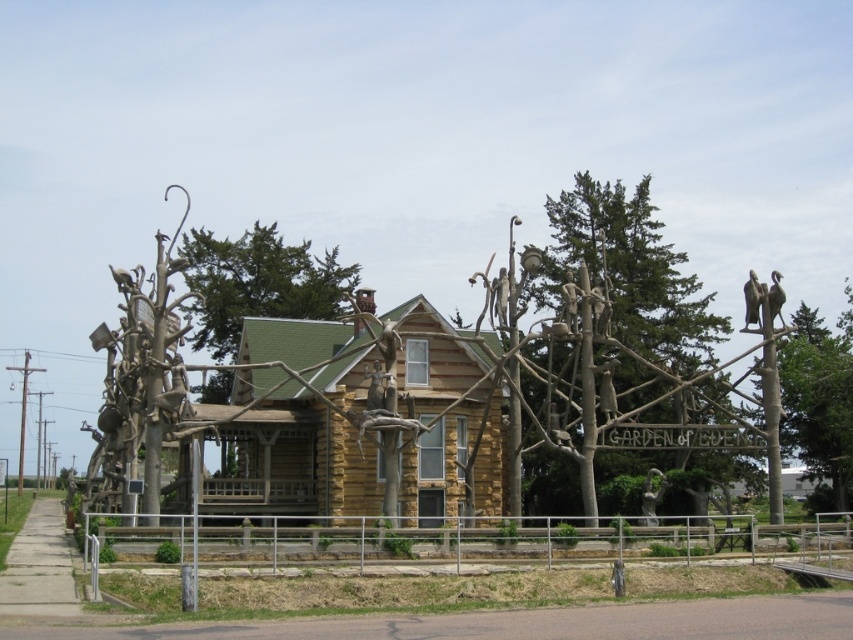
Question: Based on their relative distances, which object is farther from the polished bronze statue at upper right?

Choices:
 (A) polished bronze statue at center
 (B) wooden sculpture at center
 (C) green shingles at center
 (D) wooden log cabin at center

Answer: (C)

Question: Which point is closer to the camera taking this photo?

Choices:
 (A) (320, 484)
 (B) (807, 465)
 (C) (550, 360)
 (D) (300, 269)

Answer: (C)

Question: Which object appears farthest from the camera in this image?

Choices:
 (A) brown wooden tree at right
 (B) polished bronze statue at upper right
 (C) polished bronze statue at center
 (D) wooden sculpture at center

Answer: (B)

Question: Is wooden log cabin at center smaller than wooden sculpture at center?

Choices:
 (A) yes
 (B) no

Answer: (A)

Question: Can you confirm if wooden log cabin at center is smaller than brown wooden tree at right?

Choices:
 (A) no
 (B) yes

Answer: (B)

Question: Does wooden log cabin at center have a greater width compared to wooden sculpture at center?

Choices:
 (A) no
 (B) yes

Answer: (B)